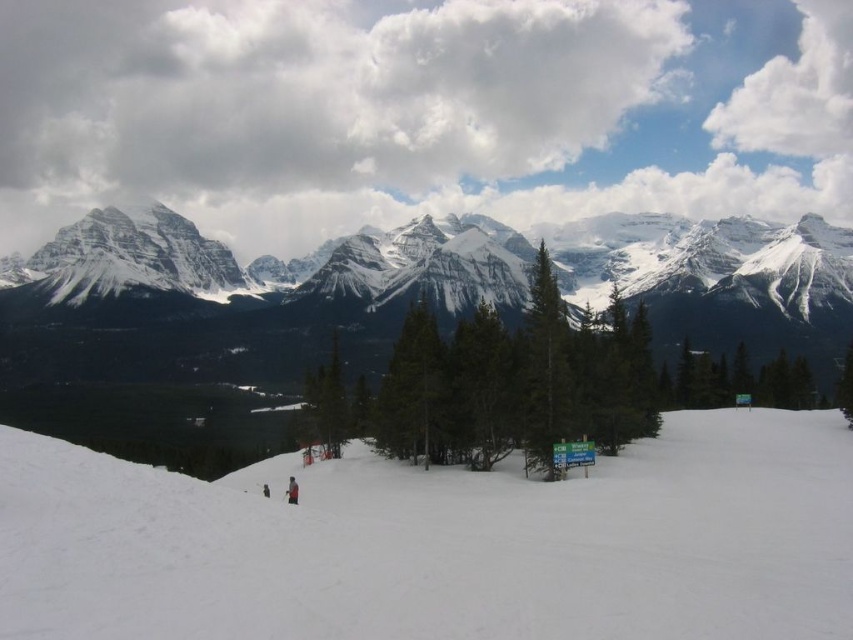
From the picture: You are a photographer planning to capture the white snow at center and the snowy granite mountain range at upper center in a single shot. Based on their relative heights, which one will appear larger in the photo?

The white snow at center will appear larger in the photo because it is not as tall as the snowy granite mountain range at upper center, but its proximity to the camera makes it cover more of the frame.

You are a skier on the slope and want to reach the signboard near the trees. Which tree, the green textured pine at center or the green matte tree at center, would you see first as you approach the signboard?

The green textured pine at center is in front of the green matte tree at center, so you would see the green textured pine at center first as you approach the signboard.